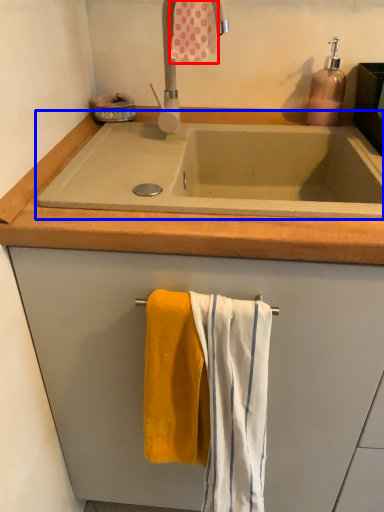
Question: Which object appears farthest to the camera in this image, bath towel (highlighted by a red box) or bath (highlighted by a blue box)?

Choices:
 (A) bath towel
 (B) bath

Answer: (A)